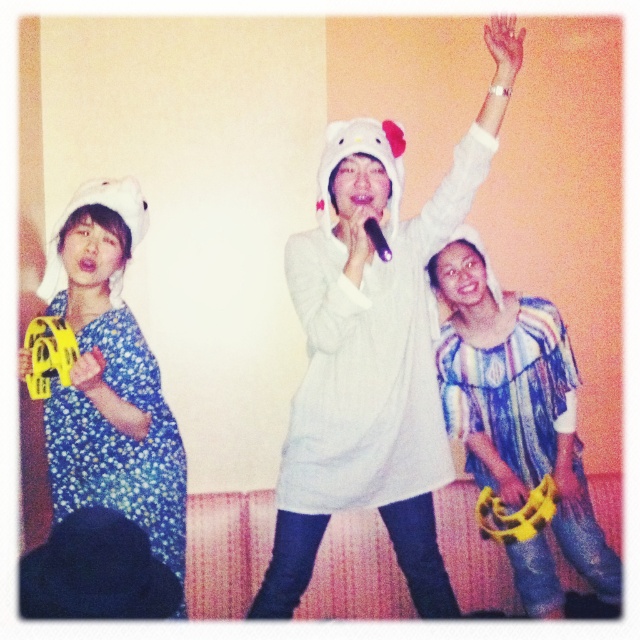
You are standing in front of the scene and want to pick up the white plush hello kitty hat at center. Can you reach it without moving your feet?

The white plush hello kitty hat at center is 5.52 feet away from viewer, which is too far to reach without moving your feet.

What is the position of the white plush hello kitty hat at center?

The white plush hello kitty hat at center is located at point (369, 365).